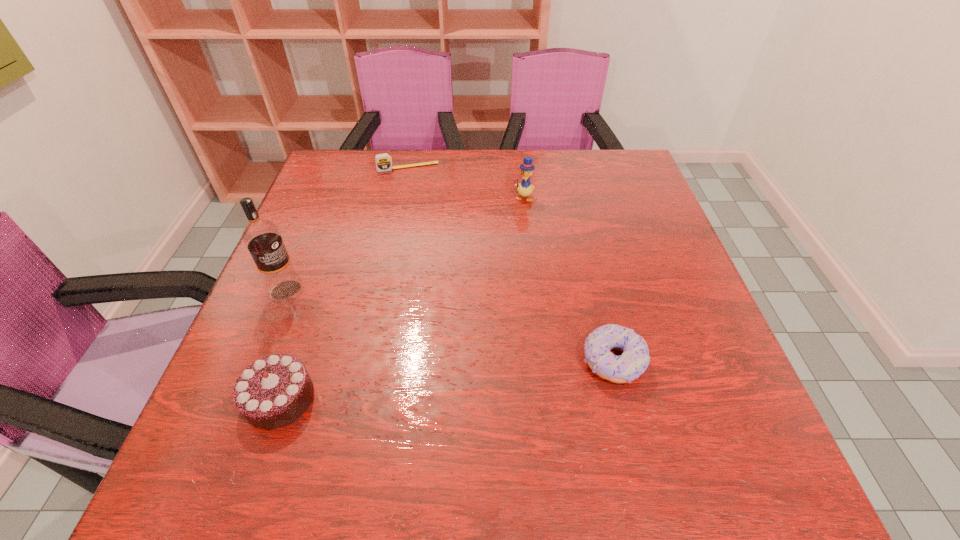
The height and width of the screenshot is (540, 960). What are the coordinates of `the third tallest object` in the screenshot? It's located at (274, 391).

At what (x,y) coordinates should I click in order to perform the action: click on the rightmost object. Please return your answer as a coordinate pair (x, y). This screenshot has height=540, width=960. Looking at the image, I should click on (633, 362).

Locate an element on the screen. Image resolution: width=960 pixels, height=540 pixels. duckling is located at coordinates (525, 189).

Identify the location of the fourth nearest object. This screenshot has height=540, width=960. (525, 189).

The image size is (960, 540). Identify the location of vodka. (262, 237).

Identify the location of the tallest object. (262, 237).

Identify the location of the farthest object. Image resolution: width=960 pixels, height=540 pixels. (383, 161).

Where is `free space located on the right of the chocolate cake`? The width and height of the screenshot is (960, 540). free space located on the right of the chocolate cake is located at coordinates (540, 398).

Locate an element on the screen. This screenshot has width=960, height=540. vacant space located 0.090m on the back of the rightmost object is located at coordinates (598, 301).

The height and width of the screenshot is (540, 960). I want to click on vacant region located 0.200m on the face of the fourth shortest object, where the monocle is placed, so click(506, 252).